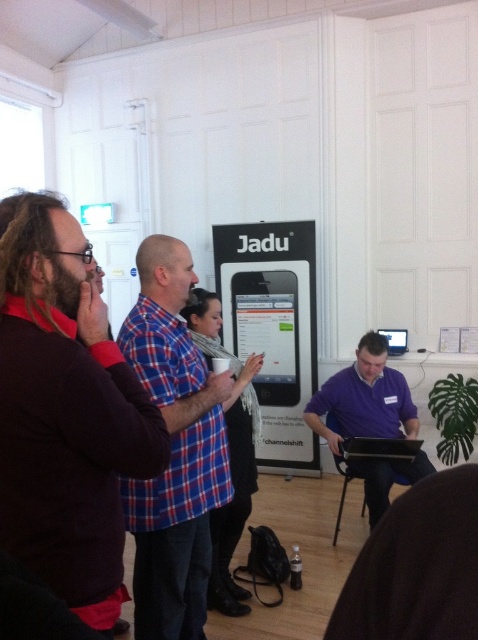
You are a photographer standing at the back of the room. You want to take a photo of both the blue plaid shirt at center and the purple matte shirt at center without any overlap. Given that your camera has a maximum focus range of 1.5 meters, will you be able to capture both subjects clearly in the same frame?

The blue plaid shirt at center is 1.40 meters away from the purple matte shirt at center. Since the distance between them is within the camera maximum focus range of 1.5 meters, you can capture both subjects clearly in the same frame.

You are organizing a presentation and need to arrange seating for attendees. The dark brown sweater at left and the black plastic laptop at center are in the room. Which object takes up more space horizontally?

The black plastic laptop at center takes up more space horizontally because its width is greater than the dark brown sweater at left.